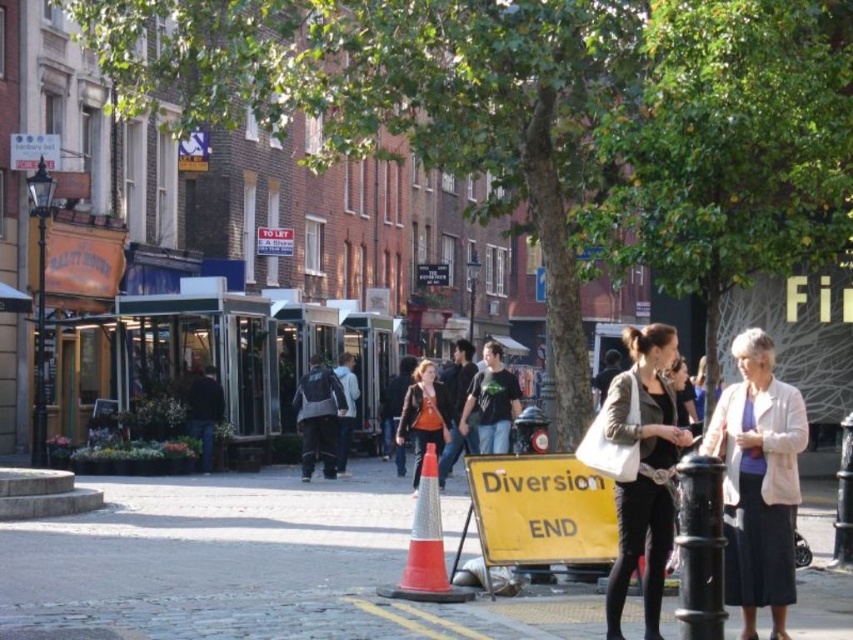
Question: Which is nearer to the matte white bag at center?

Choices:
 (A) orange reflective cone at center
 (B) leather jacket at center

Answer: (A)

Question: Which point is closer to the camera taking this photo?

Choices:
 (A) (679, 429)
 (B) (410, 406)
 (C) (728, 529)

Answer: (A)

Question: Is cobblestone pavement at center positioned in front of leather jacket at center?

Choices:
 (A) yes
 (B) no

Answer: (A)

Question: Can you confirm if matte white bag at center is smaller than orange reflective cone at center?

Choices:
 (A) yes
 (B) no

Answer: (A)

Question: Can you confirm if light beige jacket at lower right is positioned above matte white bag at center?

Choices:
 (A) yes
 (B) no

Answer: (A)

Question: Among these points, which one is nearest to the camera?

Choices:
 (A) (408, 556)
 (B) (654, 493)
 (C) (741, 385)
 (D) (397, 438)

Answer: (B)